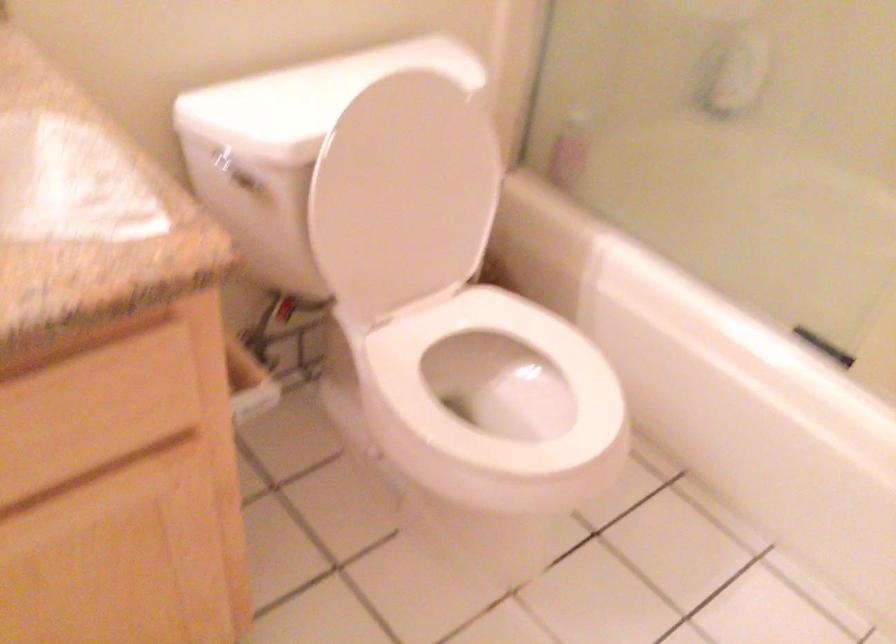
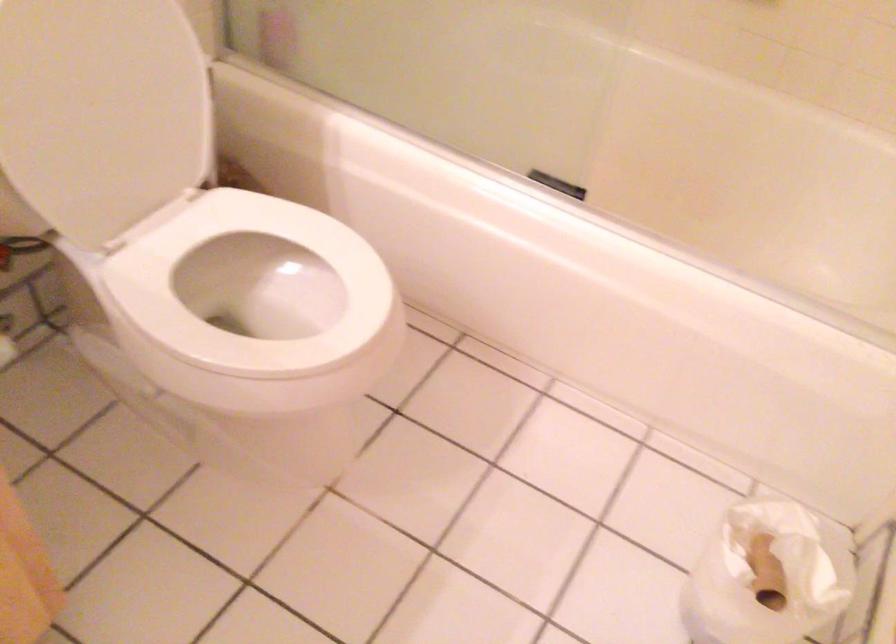
Question: Based on the continuous images, in which direction is the camera rotating? Reply with the corresponding letter.

Choices:
 (A) Left
 (B) Right
 (C) Up
 (D) Down

Answer: (B)